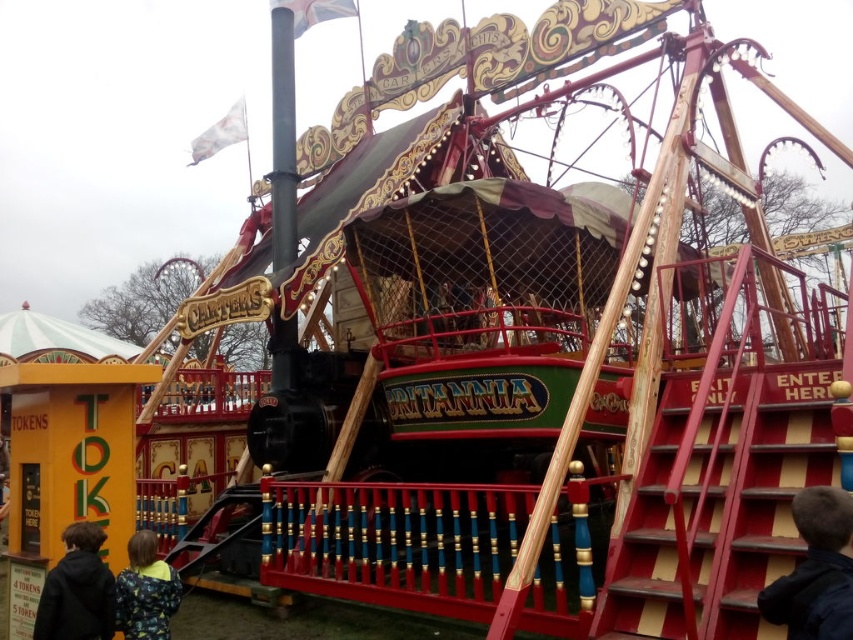
Question: Can you confirm if dark blue jacket at lower left is smaller than camouflage jacket at lower left?

Choices:
 (A) yes
 (B) no

Answer: (A)

Question: Which point is farther to the camera?

Choices:
 (A) dark blue jacket at lower right
 (B) dark blue jacket at lower left

Answer: (B)

Question: Considering the relative positions of dark blue jacket at lower right and camouflage jacket at lower left in the image provided, where is dark blue jacket at lower right located with respect to camouflage jacket at lower left?

Choices:
 (A) below
 (B) above

Answer: (B)

Question: Does dark blue jacket at lower right appear on the right side of dark blue jacket at lower left?

Choices:
 (A) no
 (B) yes

Answer: (B)

Question: Among these objects, which one is farthest from the camera?

Choices:
 (A) dark blue jacket at lower right
 (B) camouflage jacket at lower left

Answer: (B)

Question: Among these objects, which one is farthest from the camera?

Choices:
 (A) dark blue jacket at lower right
 (B) dark blue jacket at lower left
 (C) camouflage jacket at lower left

Answer: (C)